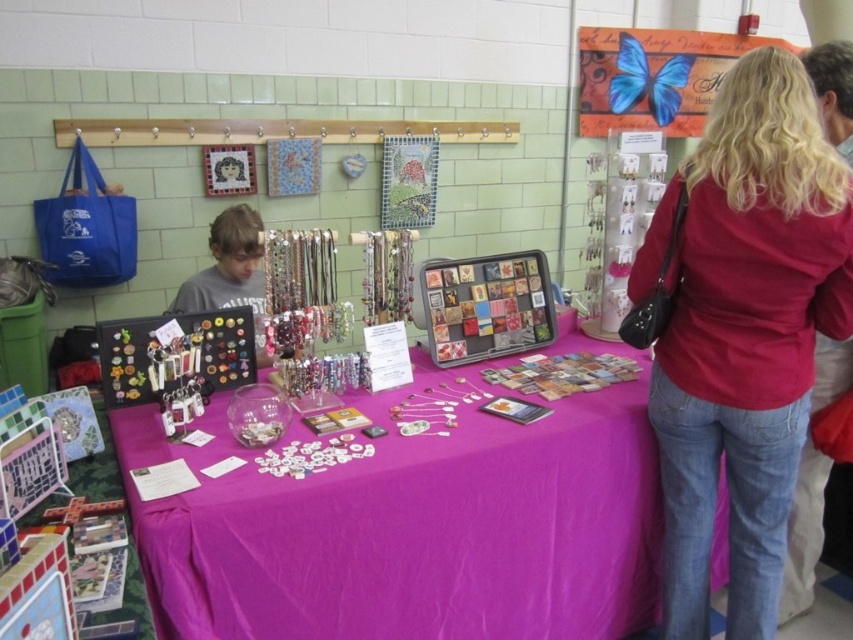
You are standing at the craft fair stall. There is a point marked at coordinates [222,620] on the table. If you want to place a 3.5 feet long decorative banner between yourself and that point, will it fit without overlapping anything?

The distance between you and the point is 4.43 feet. Since the banner is 3.5 feet long, it will fit as it is shorter than the available space.

Consider the image. You are a customer at the craft fair and want to buy both the matte red shirt at center and the matte blue butterfly at upper right. The vendor says you can get a discount if you place them together in a box that is 10 cm tall. Can you determine if they will fit?

The matte red shirt at center is taller than the matte blue butterfly at upper right. Since the box is 10 cm tall, but we don not know the exact height of the shirt, we cannot determine if they will fit together in the box.